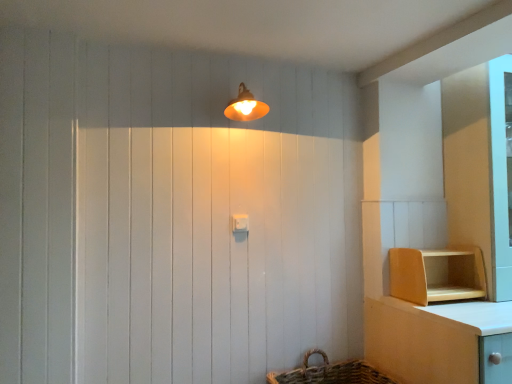
Question: From the image's perspective, is matte orange lampshade at upper center below white plastic light switch at center?

Choices:
 (A) yes
 (B) no

Answer: (B)

Question: From a real-world perspective, is matte orange lampshade at upper center on top of white plastic light switch at center?

Choices:
 (A) yes
 (B) no

Answer: (A)

Question: Does matte orange lampshade at upper center have a smaller size compared to white plastic light switch at center?

Choices:
 (A) no
 (B) yes

Answer: (A)

Question: Does matte orange lampshade at upper center have a lesser width compared to white plastic light switch at center?

Choices:
 (A) yes
 (B) no

Answer: (B)

Question: Can you confirm if matte orange lampshade at upper center is taller than white plastic light switch at center?

Choices:
 (A) yes
 (B) no

Answer: (A)

Question: Is white plastic light switch at center taller or shorter than wooden shelf at lower right?

Choices:
 (A) tall
 (B) short

Answer: (B)

Question: Relative to wooden shelf at lower right, is white plastic light switch at center in front or behind?

Choices:
 (A) behind
 (B) front

Answer: (A)

Question: Is white plastic light switch at center bigger or smaller than wooden shelf at lower right?

Choices:
 (A) small
 (B) big

Answer: (A)

Question: Which is correct: white plastic light switch at center is inside wooden shelf at lower right, or outside of it?

Choices:
 (A) inside
 (B) outside

Answer: (B)

Question: Based on their sizes in the image, would you say wooden shelf at lower right is bigger or smaller than white plastic light switch at center?

Choices:
 (A) big
 (B) small

Answer: (A)

Question: Is point (451, 268) closer or farther from the camera than point (243, 221)?

Choices:
 (A) closer
 (B) farther

Answer: (B)

Question: From the image's perspective, is wooden shelf at lower right above or below white plastic light switch at center?

Choices:
 (A) above
 (B) below

Answer: (B)

Question: From a real-world perspective, is wooden shelf at lower right physically located above or below white plastic light switch at center?

Choices:
 (A) below
 (B) above

Answer: (A)

Question: Considering the positions of matte orange lampshade at upper center and wooden shelf at lower right in the image, is matte orange lampshade at upper center bigger or smaller than wooden shelf at lower right?

Choices:
 (A) small
 (B) big

Answer: (A)

Question: Considering the positions of matte orange lampshade at upper center and wooden shelf at lower right in the image, is matte orange lampshade at upper center taller or shorter than wooden shelf at lower right?

Choices:
 (A) short
 (B) tall

Answer: (A)